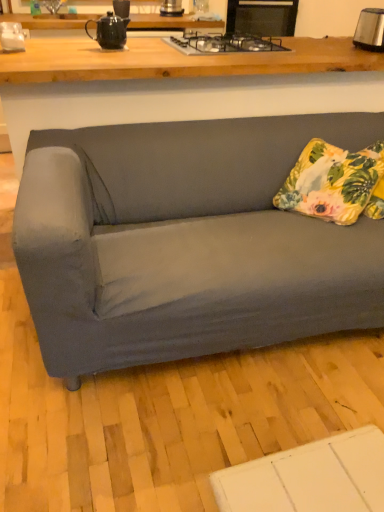
Locate an element on the screen. free location to the left of matte black teapot at upper center is located at coordinates (73, 46).